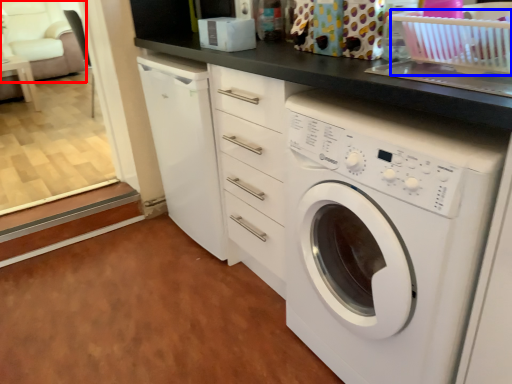
Question: Among these objects, which one is nearest to the camera, armchair (highlighted by a red box) or basket (highlighted by a blue box)?

Choices:
 (A) armchair
 (B) basket

Answer: (B)